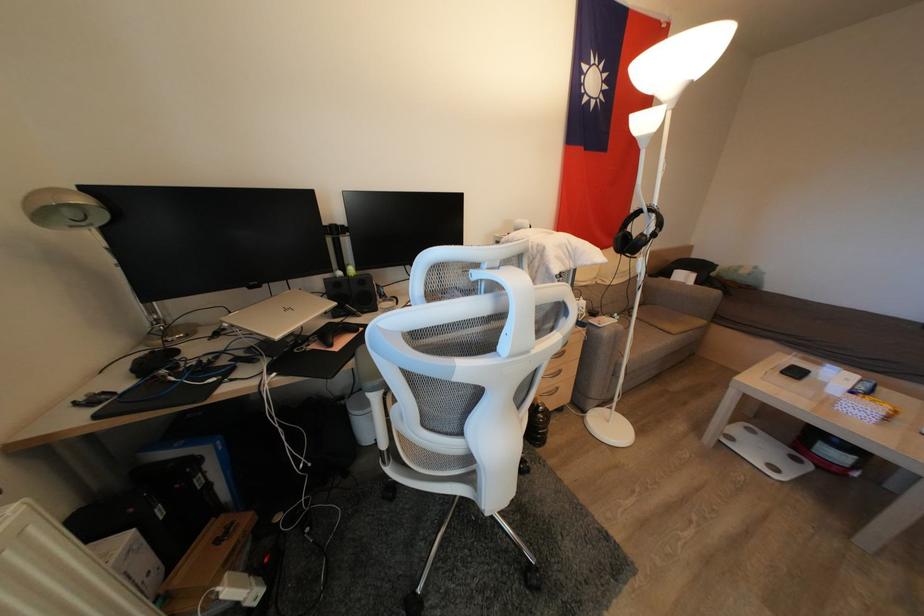
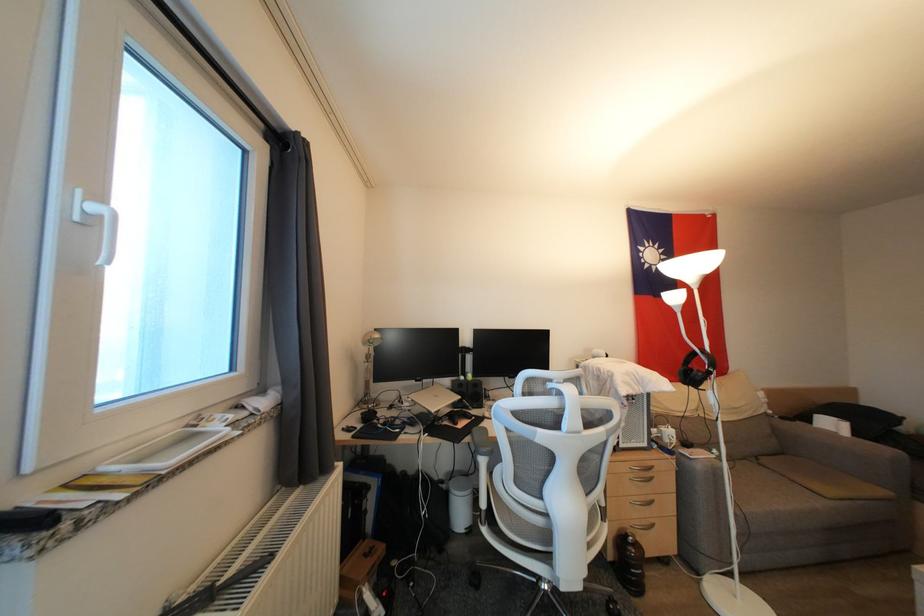
The point at (346, 402) is marked in the first image. Where is the corresponding point in the second image?

(447, 485)